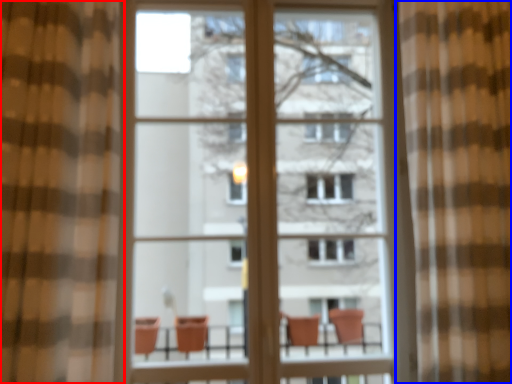
Question: Which of the following is the farthest to the observer, curtain (highlighted by a red box) or curtain (highlighted by a blue box)?

Choices:
 (A) curtain
 (B) curtain

Answer: (B)